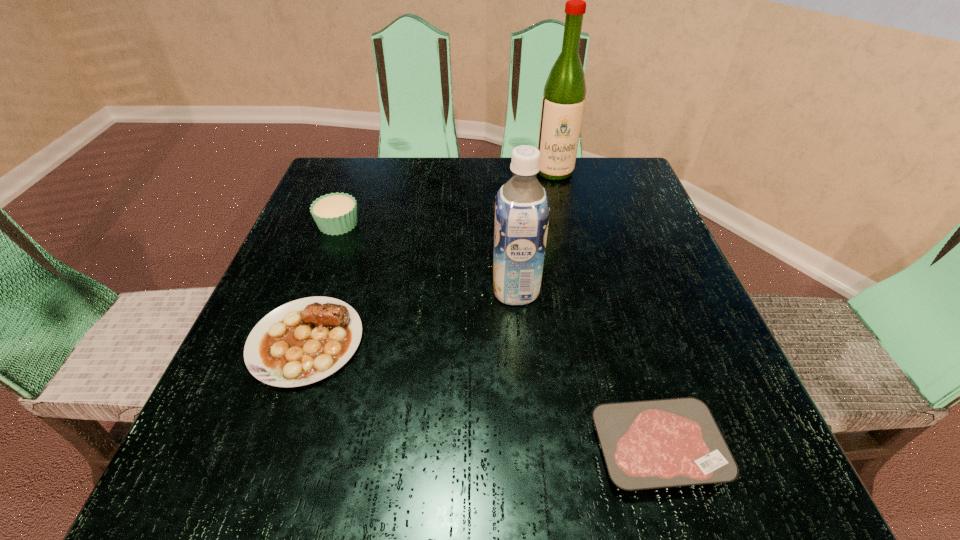
Where is `free area in between the shortest object and the left steak`? free area in between the shortest object and the left steak is located at coordinates (482, 395).

This screenshot has width=960, height=540. What are the coordinates of `vacant region between the cupcake and the nearer steak` in the screenshot? It's located at (498, 336).

Identify the location of free space between the left steak and the fourth shortest object. (411, 316).

Identify which object is the closest to the second tallest object. Please provide its 2D coordinates. Your answer should be formatted as a tuple, i.e. [(x, y)], where the tuple contains the x and y coordinates of a point satisfying the conditions above.

[(649, 444)]

The width and height of the screenshot is (960, 540). Identify the location of object that is the fourth closest to the shorter steak. click(563, 101).

This screenshot has height=540, width=960. In order to click on vacant space that satisfies the following two spatial constraints: 1. on the label of the shorter steak; 2. on the left side of the liquor in this screenshot , I will do `click(618, 448)`.

Identify the location of free space that satisfies the following two spatial constraints: 1. on the back side of the nearer steak; 2. on the label of the fourth shortest object. This screenshot has height=540, width=960. (611, 290).

Identify the location of free spot that satisfies the following two spatial constraints: 1. on the front side of the left steak; 2. on the left side of the shorter steak. The height and width of the screenshot is (540, 960). (268, 448).

What are the coordinates of `free region that satisfies the following two spatial constraints: 1. on the front side of the fourth nearest object; 2. on the left side of the shorter steak` in the screenshot? It's located at (253, 448).

Locate an element on the screen. The image size is (960, 540). free space that satisfies the following two spatial constraints: 1. on the back side of the shortest object; 2. on the label of the second tallest object is located at coordinates (611, 290).